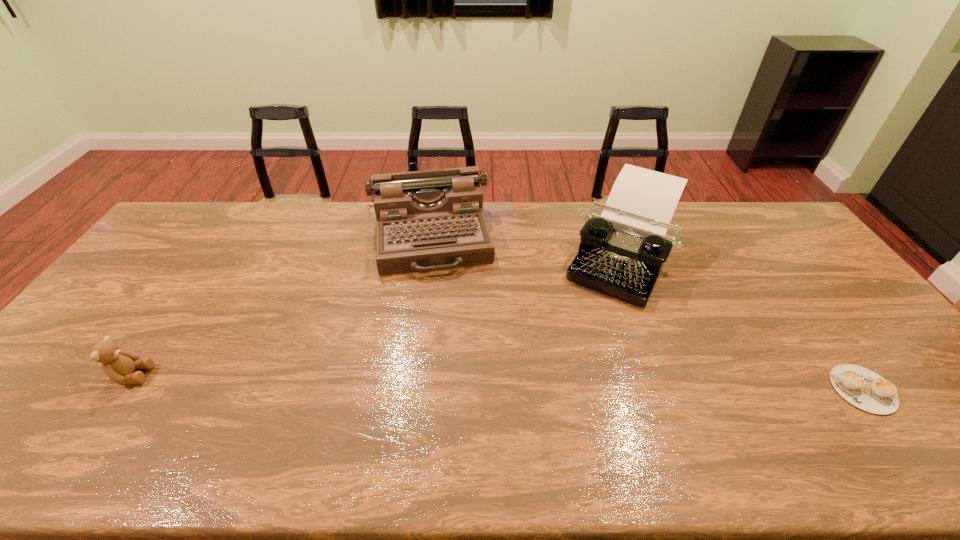
The width and height of the screenshot is (960, 540). Find the location of `unoccupied position between the second shortest object and the rightmost object`. unoccupied position between the second shortest object and the rightmost object is located at coordinates (497, 382).

Where is `empty space between the third object from left to right and the left typewriter`? empty space between the third object from left to right and the left typewriter is located at coordinates (526, 246).

Identify the location of blank region between the left typewriter and the shortest object. (646, 313).

Identify the location of free space between the third object from left to right and the left typewriter. (526, 246).

At what (x,y) coordinates should I click in order to perform the action: click on vacant point located between the cappuccino and the left typewriter. Please return your answer as a coordinate pair (x, y). Looking at the image, I should click on (646, 313).

You are a GUI agent. You are given a task and a screenshot of the screen. Output one action in this format:
    pyautogui.click(x=<x>, y=<y>)
    Task: Click on the vacant area between the third object from right to left and the second shortest object
    This screenshot has width=960, height=540.
    Given the screenshot: What is the action you would take?
    click(x=281, y=306)

This screenshot has height=540, width=960. In order to click on empty space between the second object from left to right and the right typewriter in this screenshot , I will do `click(526, 246)`.

The width and height of the screenshot is (960, 540). I want to click on free space between the third object from left to right and the teddy bear, so click(x=377, y=315).

You are a GUI agent. You are given a task and a screenshot of the screen. Output one action in this format:
    pyautogui.click(x=<x>, y=<y>)
    Task: Click on the empty location between the cappuccino and the second object from right to left
    
    Given the screenshot: What is the action you would take?
    pyautogui.click(x=742, y=322)

You are a GUI agent. You are given a task and a screenshot of the screen. Output one action in this format:
    pyautogui.click(x=<x>, y=<y>)
    Task: Click on the free space between the left typewriter and the right typewriter
    Image resolution: width=960 pixels, height=540 pixels.
    Given the screenshot: What is the action you would take?
    pyautogui.click(x=526, y=246)